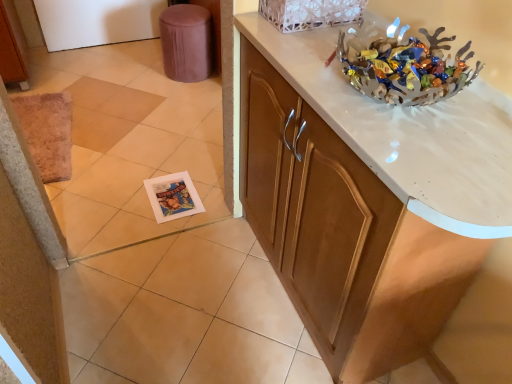
The image size is (512, 384). Identify the location of free space in front of white lace basket at upper center. (303, 44).